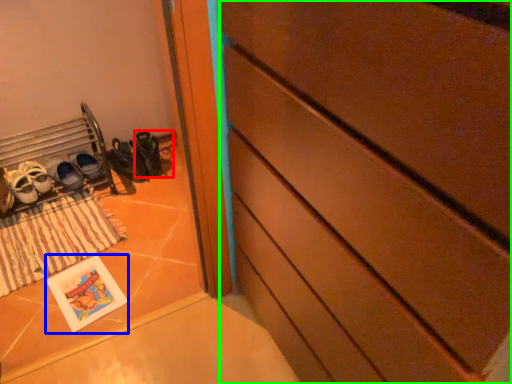
Question: Considering the real-world distances, which object is farthest from shoe (highlighted by a red box)? postcard (highlighted by a blue box) or chest of drawers (highlighted by a green box)?

Choices:
 (A) postcard
 (B) chest of drawers

Answer: (B)